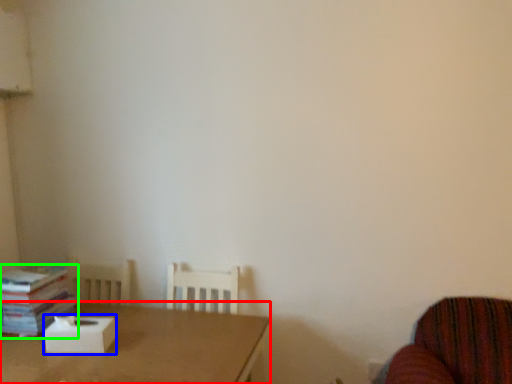
Question: Which is nearer to the table (highlighted by a red box)? cardboard box (highlighted by a blue box) or book (highlighted by a green box).

Choices:
 (A) cardboard box
 (B) book

Answer: (A)